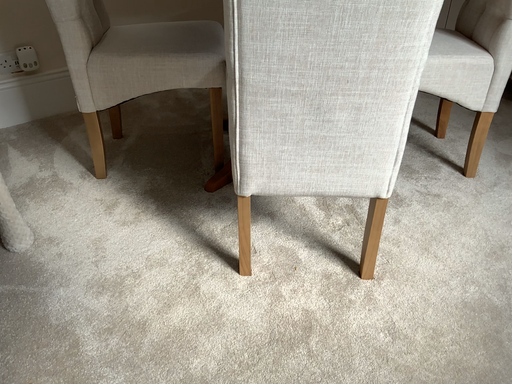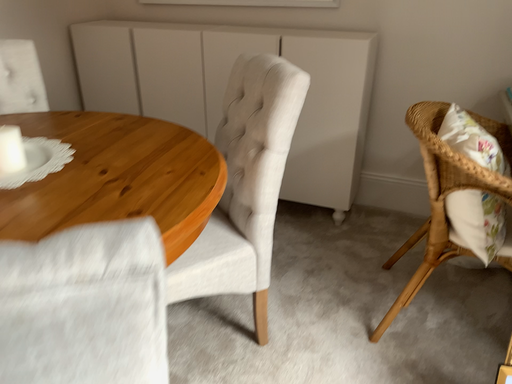
Question: Which way did the camera rotate in the video?

Choices:
 (A) rotated upward
 (B) rotated downward

Answer: (A)